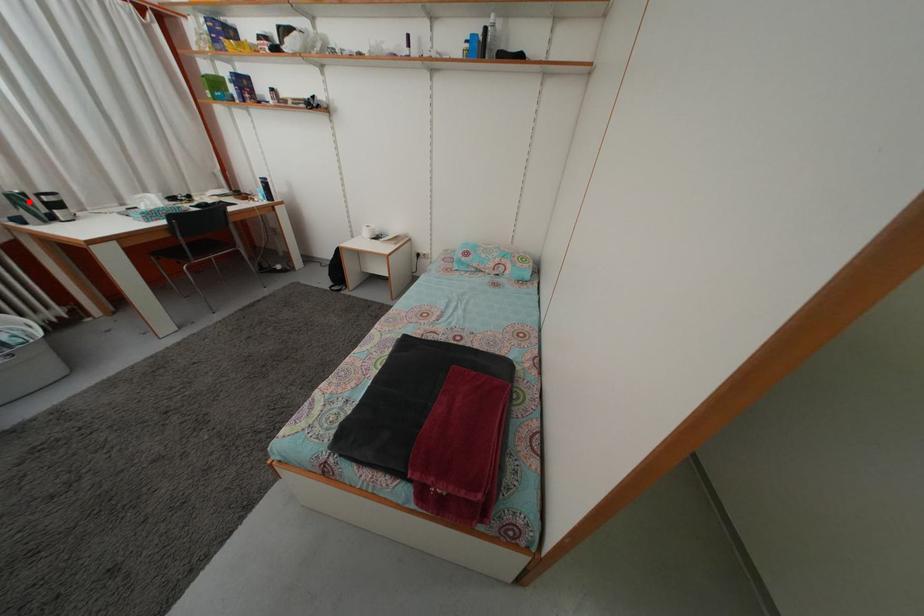
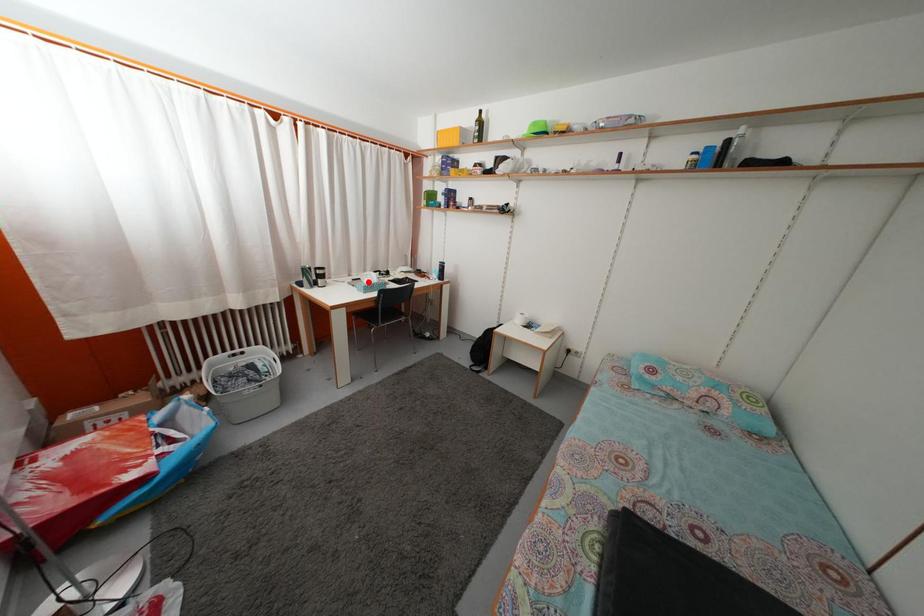
I am providing you with two images of the same scene from different viewpoints. A red point is marked on the first image and another point is marked on the second image. Are the points marked in image1 and image2 representing the same 3D position?

No